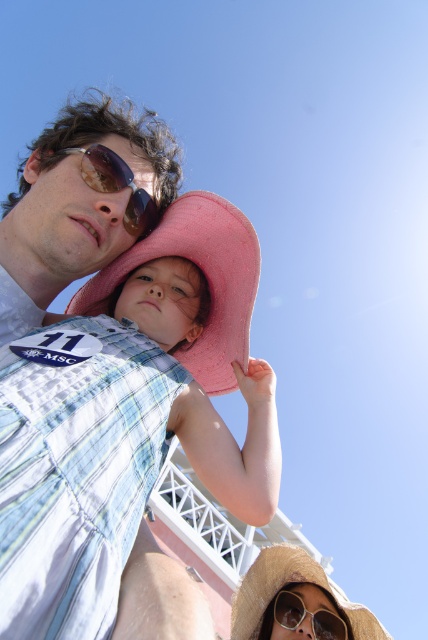
You are a photographer trying to capture the child wearing the pink fabric hat at upper center. The camera is positioned at the origin point. Which direction should you move the camera to focus on the hat?

The pink fabric hat at upper center is located at point 0.656 on the x axis and 0.301 on the y axis. Since the camera is at the origin, you should move it to the right along the x axis and slightly up along the y axis to focus on the hat.

You are a photographer standing at the center of the scene. You want to place a small sticker exactly where the shiny brown goggles at center are located. What coordinates should you use to ensure the sticker is placed correctly?

The coordinates for the shiny brown goggles at center are at point (116, 186). So you should place the sticker at those coordinates to ensure accuracy.

You are a photographer trying to capture a photo of the pink fabric hat at upper center and the matte blue denim vest at upper left in the scene. Given that your camera has a maximum focus range of 5 meters, will you be able to get both items in focus at the same time?

The pink fabric hat at upper center and the matte blue denim vest at upper left are 5.42 meters apart. Since the camera can only focus up to 5 meters, the distance between them exceeds the maximum focus range. Therefore, you cannot get both items in focus simultaneously.